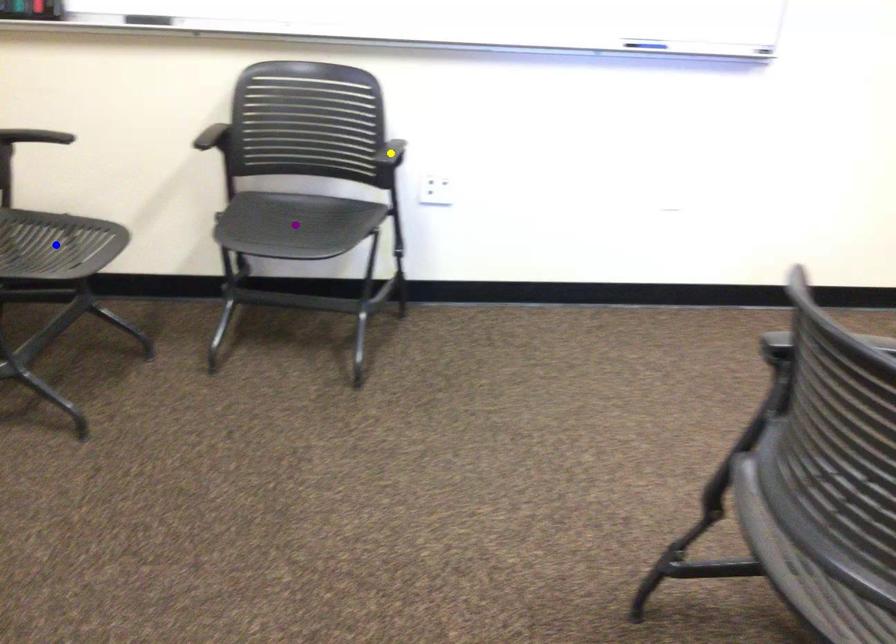
Order these from nearest to farthest:
1. yellow point
2. purple point
3. blue point

1. yellow point
2. purple point
3. blue point